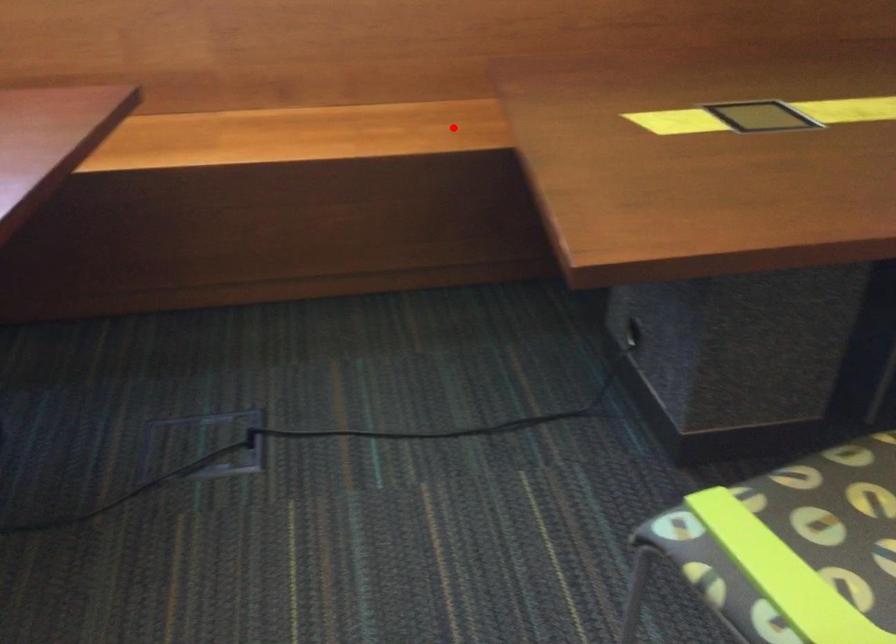
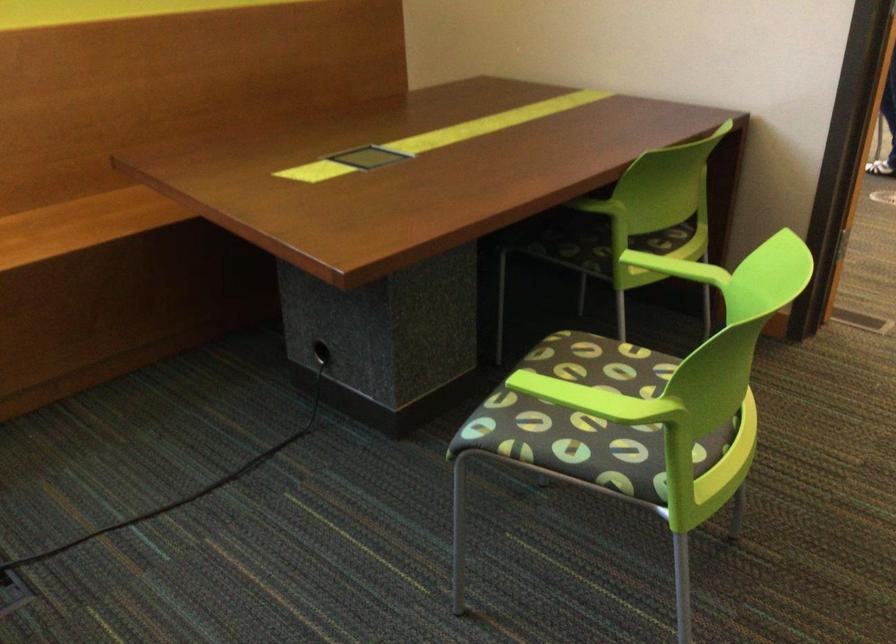
Locate, in the second image, the point that corresponds to the highlighted location in the first image.

(80, 223)